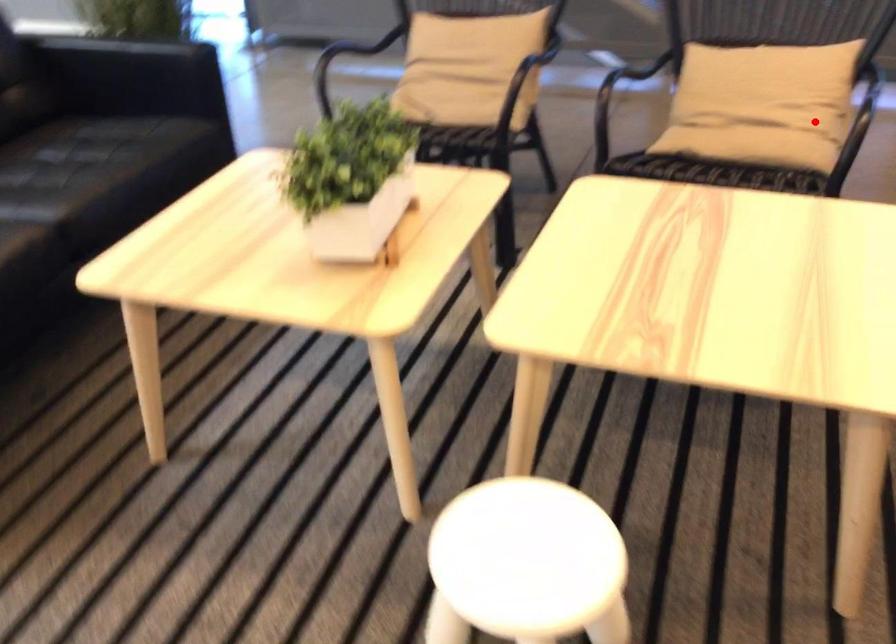
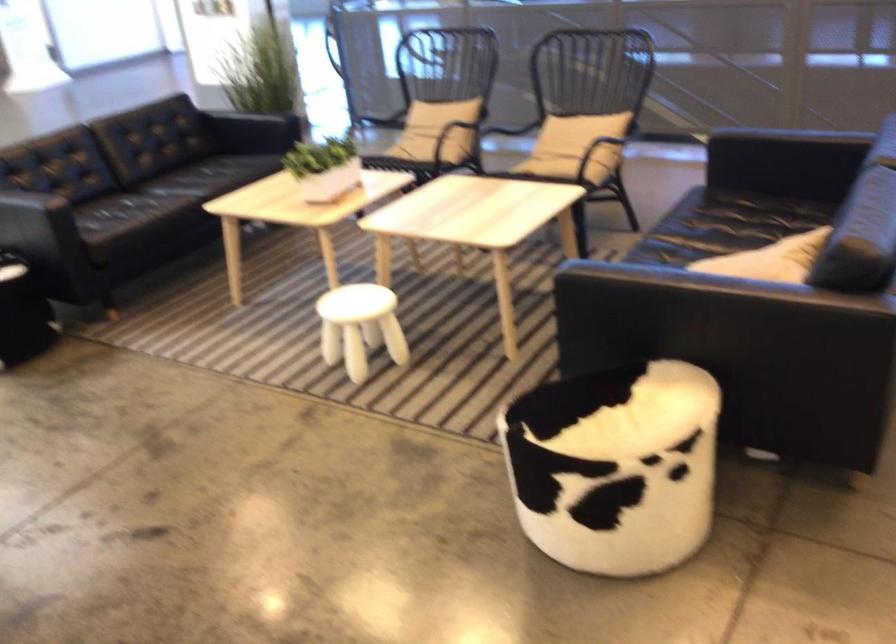
Question: I am providing you with two images of the same scene from different viewpoints. Image1 has a red point marked. In image2, the corresponding 3D location appears at what relative position? Reply with the corresponding letter.

Choices:
 (A) Closer
 (B) Farther

Answer: (B)